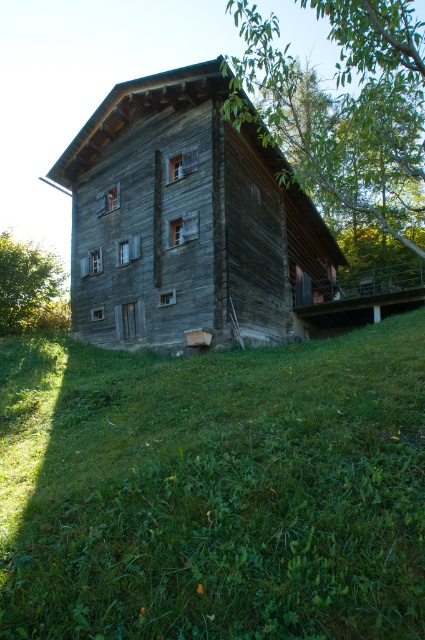
You are standing on the grassy slope and want to take a photo of the weathered wood hut at center and the green leafy tree at lower left. Which object should you focus on first if you want both to be in sharp focus?

The weathered wood hut at center is closer to the viewer than the green leafy tree at lower left. To have both in sharp focus, focus on the green leafy tree at lower left since it is farther away, ensuring the depth of field includes both objects.

You are standing at the base of the slope looking towards the rustic wooden building. You notice the green grassy at lower center and the green leafy tree at lower left. Which of these two is taller?

The green leafy tree at lower left is taller than the green grassy at lower center.

Looking at this image, you are standing at the point marked as point (184, 220). What structure can you see directly in front of you?

The weathered wood hut at center is located at point (184, 220), so you can see the weathered wood hut at center directly in front of you.